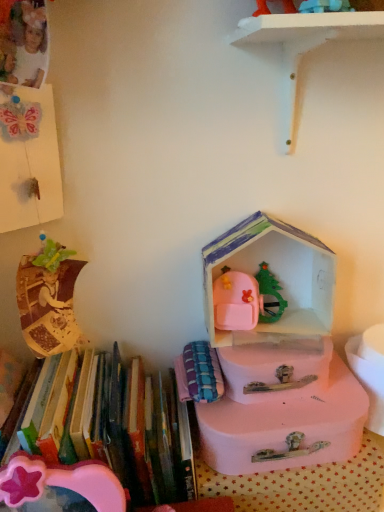
At what (x,y) coordinates should I click in order to perform the action: click on pink cardboard house at center, acting as the 1th storage box starting from the top. Please return your answer as a coordinate pair (x, y). Looking at the image, I should click on (275, 275).

I want to click on pink plastic box at center, so click(x=276, y=368).

How much space does pink plastic suitcase at center, which ranks as the second storage box in top-to-bottom order, occupy vertically?

4.21 inches.

Where is `white matte shelf at upper center`? white matte shelf at upper center is located at coordinates (304, 44).

Where is `pink cardboard house at center, acting as the 1th storage box starting from the top`? pink cardboard house at center, acting as the 1th storage box starting from the top is located at coordinates (275, 275).

Does pink plastic box at center turn towards pink plastic suitcase at center, which ranks as the second storage box in top-to-bottom order?

No, pink plastic box at center is not facing towards pink plastic suitcase at center, which ranks as the second storage box in top-to-bottom order.

Which object is positioned more to the right, pink plastic box at center or pink plastic suitcase at center, which ranks as the second storage box in top-to-bottom order?

Positioned to the right is pink plastic box at center.

Does point (315, 361) lie in front of point (225, 425)?

No, it is behind (225, 425).

You are a GUI agent. You are given a task and a screenshot of the screen. Output one action in this format:
    pyautogui.click(x=<x>, y=<y>)
    Task: Click on the box above the pink plastic suitcase at center, the 1th storage box positioned from the bottom (from the image's perspective)
    The image size is (384, 512).
    Given the screenshot: What is the action you would take?
    (276, 368)

Based on their sizes in the image, would you say pink cardboard house at center, positioned as the second storage box in bottom-to-top order, is bigger or smaller than white matte shelf at upper center?

Considering their sizes, pink cardboard house at center, positioned as the second storage box in bottom-to-top order, takes up less space than white matte shelf at upper center.

Is white matte shelf at upper center at the back of pink cardboard house at center, positioned as the second storage box in bottom-to-top order?

pink cardboard house at center, positioned as the second storage box in bottom-to-top order, does not have its back to white matte shelf at upper center.

Are pink cardboard house at center, positioned as the second storage box in bottom-to-top order, and white matte shelf at upper center far apart?

They are positioned close to each other.

The image size is (384, 512). Identify the location of the 1st storage box below the white matte shelf at upper center (from a real-world perspective). (275, 275).

Between white matte shelf at upper center and pink cardboard house at center, positioned as the second storage box in bottom-to-top order, which one has larger size?

white matte shelf at upper center is bigger.

Is white matte shelf at upper center positioned beyond the bounds of pink cardboard house at center, acting as the 1th storage box starting from the top?

Yes.

Is pink cardboard house at center, acting as the 1th storage box starting from the top, at the back of white matte shelf at upper center?

That's not correct — white matte shelf at upper center is not looking away from pink cardboard house at center, acting as the 1th storage box starting from the top.

Is pink plastic suitcase at center, which ranks as the second storage box in top-to-bottom order, thinner than white matte shelf at upper center?

No.

Who is smaller, pink plastic suitcase at center, which ranks as the second storage box in top-to-bottom order, or white matte shelf at upper center?

pink plastic suitcase at center, which ranks as the second storage box in top-to-bottom order, is smaller.

From a real-world perspective, between pink plastic suitcase at center, the 1th storage box positioned from the bottom, and white matte shelf at upper center, who is vertically higher?

white matte shelf at upper center is physically above.

Is pink plastic box at center facing towards plaid fabric book at center, the first book viewed from the right?

No, pink plastic box at center is not aimed at plaid fabric book at center, the first book viewed from the right.

Who is shorter, pink plastic box at center or plaid fabric book at center, which ranks as the 2th book in left-to-right order?

With less height is plaid fabric book at center, which ranks as the 2th book in left-to-right order.

Which point is more forward, (x=289, y=356) or (x=202, y=398)?

The point (x=289, y=356) is closer to the camera.

Locate an element on the screen. The width and height of the screenshot is (384, 512). box that appears behind the plaid fabric book at center, which ranks as the 2th book in left-to-right order is located at coordinates (276, 368).

How distant is pink plastic suitcase at center, which ranks as the second storage box in top-to-bottom order, from pink plastic box at center?

2.40 inches.

Find the location of a particular element. Image resolution: width=384 pixels, height=512 pixels. box lying above the pink plastic suitcase at center, which ranks as the second storage box in top-to-bottom order (from the image's perspective) is located at coordinates (276, 368).

From the picture: Is pink plastic suitcase at center, which ranks as the second storage box in top-to-bottom order, in front of or behind pink plastic box at center in the image?

Visually, pink plastic suitcase at center, which ranks as the second storage box in top-to-bottom order, is located in front of pink plastic box at center.

Which is closer to the camera, (341, 413) or (310, 369)?

Point (341, 413) is closer to the camera than point (310, 369).

Consider the image. Is hardcover books at left, placed as the 2th book when sorted from right to left, to the left of pink plastic box at center from the viewer's perspective?

Correct, you'll find hardcover books at left, placed as the 2th book when sorted from right to left, to the left of pink plastic box at center.

In the image, is hardcover books at left, placed as the first book when sorted from left to right, positioned in front of or behind pink plastic box at center?

Visually, hardcover books at left, placed as the first book when sorted from left to right, is located in front of pink plastic box at center.

Is point (142, 455) closer or farther from the camera than point (291, 354)?

Point (142, 455) appears to be closer to the viewer than point (291, 354).

Is the surface of hardcover books at left, placed as the first book when sorted from left to right, in direct contact with pink plastic box at center?

There is a gap between hardcover books at left, placed as the first book when sorted from left to right, and pink plastic box at center.

Image resolution: width=384 pixels, height=512 pixels. In order to click on the 1st storage box in front of the pink plastic box at center in this screenshot , I will do `click(285, 428)`.

From the image's perspective, which storage box is the 1st one below the white matte shelf at upper center? Please provide its 2D coordinates.

[(275, 275)]

From the image, which object appears to be farther from white matte shelf at upper center, pink cardboard house at center, positioned as the second storage box in bottom-to-top order, or pink plastic suitcase at center, which ranks as the second storage box in top-to-bottom order?

Among the two, pink plastic suitcase at center, which ranks as the second storage box in top-to-bottom order, is located further to white matte shelf at upper center.

Considering their positions, is white matte shelf at upper center positioned further to pink plastic suitcase at center, which ranks as the second storage box in top-to-bottom order, than pink cardboard house at center, positioned as the second storage box in bottom-to-top order?

The object further to pink plastic suitcase at center, which ranks as the second storage box in top-to-bottom order, is white matte shelf at upper center.

When comparing their distances from plaid fabric book at center, the first book viewed from the right, does hardcover books at left, placed as the 2th book when sorted from right to left, or pink plastic box at center seem closer?

pink plastic box at center is positioned closer to the anchor plaid fabric book at center, the first book viewed from the right.

Looking at the image, which one is located closer to hardcover books at left, placed as the first book when sorted from left to right, pink cardboard house at center, positioned as the second storage box in bottom-to-top order, or plaid fabric book at center, which ranks as the 2th book in left-to-right order?

plaid fabric book at center, which ranks as the 2th book in left-to-right order.

Estimate the real-world distances between objects in this image. Which object is further from pink cardboard house at center, positioned as the second storage box in bottom-to-top order, pink plastic suitcase at center, the 1th storage box positioned from the bottom, or plaid fabric book at center, the first book viewed from the right?

Based on the image, pink plastic suitcase at center, the 1th storage box positioned from the bottom, appears to be further to pink cardboard house at center, positioned as the second storage box in bottom-to-top order.

Based on their spatial positions, is white matte shelf at upper center or pink plastic suitcase at center, the 1th storage box positioned from the bottom, closer to pink cardboard house at center, acting as the 1th storage box starting from the top?

Among the two, pink plastic suitcase at center, the 1th storage box positioned from the bottom, is located nearer to pink cardboard house at center, acting as the 1th storage box starting from the top.

Which object lies nearer to the anchor point plaid fabric book at center, the first book viewed from the right, hardcover books at left, placed as the first book when sorted from left to right, or pink cardboard house at center, positioned as the second storage box in bottom-to-top order?

hardcover books at left, placed as the first book when sorted from left to right.

Estimate the real-world distances between objects in this image. Which object is closer to pink plastic suitcase at center, which ranks as the second storage box in top-to-bottom order, pink plastic box at center or hardcover books at left, placed as the first book when sorted from left to right?

pink plastic box at center.

Identify the location of box between white matte shelf at upper center and hardcover books at left, placed as the first book when sorted from left to right, in the vertical direction. The image size is (384, 512). (x=276, y=368).

The image size is (384, 512). I want to click on book located between hardcover books at left, placed as the first book when sorted from left to right, and pink plastic suitcase at center, the 1th storage box positioned from the bottom, in the left-right direction, so click(x=202, y=372).

Identify the location of box that lies between pink cardboard house at center, acting as the 1th storage box starting from the top, and pink plastic suitcase at center, which ranks as the second storage box in top-to-bottom order, from top to bottom. This screenshot has width=384, height=512. (276, 368).

Where is `box between white matte shelf at upper center and plaid fabric book at center, the first book viewed from the right, in the vertical direction`? box between white matte shelf at upper center and plaid fabric book at center, the first book viewed from the right, in the vertical direction is located at coordinates (276, 368).